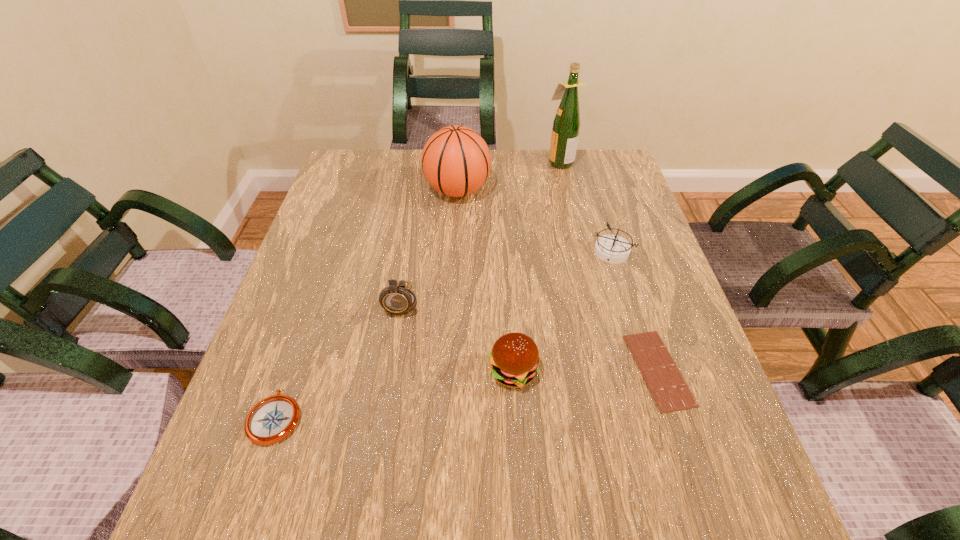
I want to click on free space located 0.180m on the front of the shortest object, so click(x=709, y=524).

You are a GUI agent. You are given a task and a screenshot of the screen. Output one action in this format:
    pyautogui.click(x=<x>, y=<y>)
    Task: Click on the liquor situated at the far edge
    The image size is (960, 540).
    Given the screenshot: What is the action you would take?
    pyautogui.click(x=566, y=125)

What are the coordinates of `basketball that is positioned at the far edge` in the screenshot? It's located at (456, 161).

Find the location of a particular element. object positioned at the left edge is located at coordinates (272, 419).

Identify the location of liquor that is at the right edge. The height and width of the screenshot is (540, 960). (566, 125).

I want to click on compass at the right edge, so click(x=614, y=249).

Where is `chocolate bar at the right edge`? The width and height of the screenshot is (960, 540). chocolate bar at the right edge is located at coordinates (670, 391).

This screenshot has width=960, height=540. What are the coordinates of `object situated at the far right corner` in the screenshot? It's located at (566, 125).

The width and height of the screenshot is (960, 540). In the image, there is a desktop. Find the location of `vacant space at the far edge`. vacant space at the far edge is located at coordinates (495, 187).

Locate an element on the screen. Image resolution: width=960 pixels, height=540 pixels. vacant space at the left edge of the desktop is located at coordinates (367, 195).